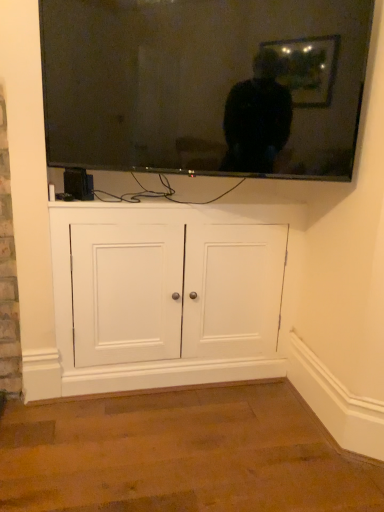
Measure the distance between white wood cabinet at center and camera.

white wood cabinet at center is 1.63 meters away from camera.

You are a GUI agent. You are given a task and a screenshot of the screen. Output one action in this format:
    pyautogui.click(x=<x>, y=<y>)
    Task: Click on the white wood cabinet at center
    
    Given the screenshot: What is the action you would take?
    pyautogui.click(x=164, y=298)

The image size is (384, 512). What do you see at coordinates (164, 298) in the screenshot?
I see `white wood cabinet at center` at bounding box center [164, 298].

What is the approximate height of white wood cabinet at center?

It is 34.17 inches.

What do you see at coordinates (205, 85) in the screenshot?
I see `flat screen tv at upper center` at bounding box center [205, 85].

Looking at this image, what is the approximate width of flat screen tv at upper center?

It is 8.10 centimeters.

Measure the distance between point (x=97, y=68) and camera.

The depth of point (x=97, y=68) is 1.51 meters.

Identify the location of flat screen tv at upper center. This screenshot has width=384, height=512. (205, 85).

This screenshot has width=384, height=512. I want to click on white wood cabinet at center, so pyautogui.click(x=164, y=298).

Is flat screen tv at upper center to the right of white wood cabinet at center from the viewer's perspective?

Correct, you'll find flat screen tv at upper center to the right of white wood cabinet at center.

Considering the positions of objects flat screen tv at upper center and white wood cabinet at center in the image provided, who is behind, flat screen tv at upper center or white wood cabinet at center?

Positioned behind is white wood cabinet at center.

Considering the positions of points (257, 80) and (230, 377), is point (257, 80) closer to camera compared to point (230, 377)?

Yes, point (257, 80) is in front of point (230, 377).

From the image's perspective, would you say flat screen tv at upper center is positioned over white wood cabinet at center?

Yes.

From a real-world perspective, is flat screen tv at upper center on top of white wood cabinet at center?

Yes, from a real-world perspective, flat screen tv at upper center is on top of white wood cabinet at center.

Between flat screen tv at upper center and white wood cabinet at center, which one has larger width?

white wood cabinet at center.

Considering the sizes of objects flat screen tv at upper center and white wood cabinet at center in the image provided, who is taller, flat screen tv at upper center or white wood cabinet at center?

With more height is white wood cabinet at center.

Who is smaller, flat screen tv at upper center or white wood cabinet at center?

flat screen tv at upper center is smaller.

Is white wood cabinet at center surrounded by flat screen tv at upper center?

No, white wood cabinet at center is not inside flat screen tv at upper center.

Is flat screen tv at upper center beside white wood cabinet at center?

No, flat screen tv at upper center is not beside white wood cabinet at center.

Is flat screen tv at upper center positioned with its back to white wood cabinet at center?

No, flat screen tv at upper center is not facing away from white wood cabinet at center.

Consider the image. How different are the orientations of flat screen tv at upper center and white wood cabinet at center in degrees?

The angle between the facing direction of flat screen tv at upper center and the facing direction of white wood cabinet at center is 22.1 degrees.

Measure the distance from flat screen tv at upper center to white wood cabinet at center.

The distance of flat screen tv at upper center from white wood cabinet at center is 21.70 inches.

Where is `cabinetry below the flat screen tv at upper center (from a real-world perspective)`? The image size is (384, 512). cabinetry below the flat screen tv at upper center (from a real-world perspective) is located at coordinates (164, 298).

Which object is positioned more to the left, white wood cabinet at center or flat screen tv at upper center?

Positioned to the left is white wood cabinet at center.

Which is behind, white wood cabinet at center or flat screen tv at upper center?

white wood cabinet at center is further from the camera.

Which is more distant, (87, 223) or (297, 42)?

Positioned behind is point (87, 223).

From the image's perspective, which is below, white wood cabinet at center or flat screen tv at upper center?

white wood cabinet at center.

From a real-world perspective, which is physically above, white wood cabinet at center or flat screen tv at upper center?

In real-world perspective, flat screen tv at upper center is above.

Considering the relative sizes of white wood cabinet at center and flat screen tv at upper center in the image provided, is white wood cabinet at center wider than flat screen tv at upper center?

Yes, white wood cabinet at center is wider than flat screen tv at upper center.

In terms of height, does white wood cabinet at center look taller or shorter compared to flat screen tv at upper center?

Clearly, white wood cabinet at center is taller compared to flat screen tv at upper center.

Does white wood cabinet at center have a larger size compared to flat screen tv at upper center?

Yes, white wood cabinet at center is bigger than flat screen tv at upper center.

Is white wood cabinet at center located outside flat screen tv at upper center?

That's correct, white wood cabinet at center is outside of flat screen tv at upper center.

Is white wood cabinet at center not close to flat screen tv at upper center?

They are positioned close to each other.

Is white wood cabinet at center aimed at flat screen tv at upper center?

No, white wood cabinet at center is not turned towards flat screen tv at upper center.

Can you tell me how much white wood cabinet at center and flat screen tv at upper center differ in facing direction?

white wood cabinet at center and flat screen tv at upper center are facing 22.1 degrees away from each other.

Find the location of `cabinetry that is under the flat screen tv at upper center (from a real-world perspective)`. cabinetry that is under the flat screen tv at upper center (from a real-world perspective) is located at coordinates (164, 298).

At what (x,y) coordinates should I click in order to perform the action: click on cabinetry behind the flat screen tv at upper center. Please return your answer as a coordinate pair (x, y). Image resolution: width=384 pixels, height=512 pixels. Looking at the image, I should click on (164, 298).

This screenshot has height=512, width=384. I want to click on television above the white wood cabinet at center (from a real-world perspective), so click(205, 85).